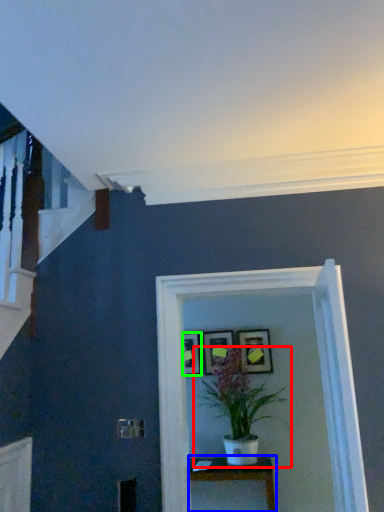
Question: Which object is positioned farthest from houseplant (highlighted by a red box)? Select from table (highlighted by a blue box) and picture frame (highlighted by a green box).

Choices:
 (A) table
 (B) picture frame

Answer: (B)